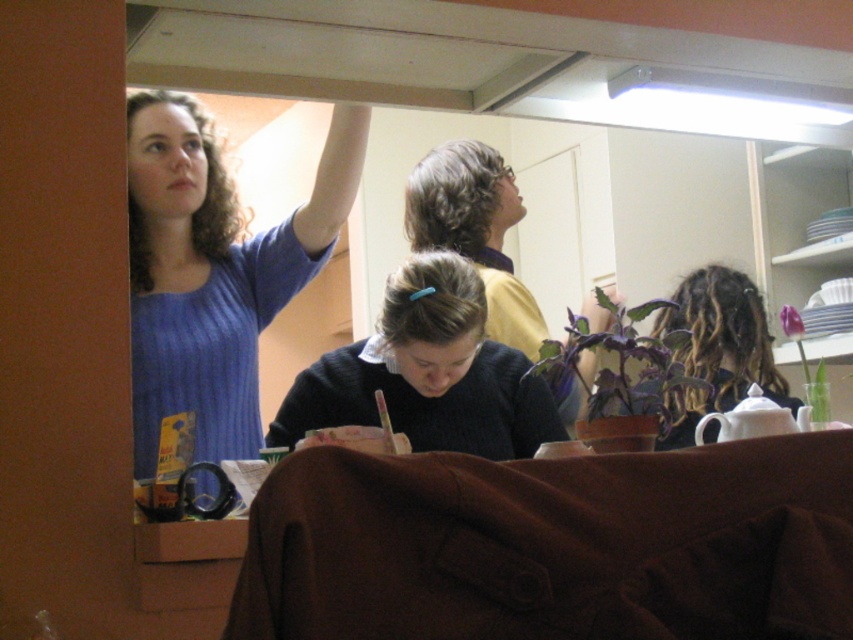
What is the object located at the coordinates point (474,230) in the image?

The point (474,230) corresponds to the black sweater at center.